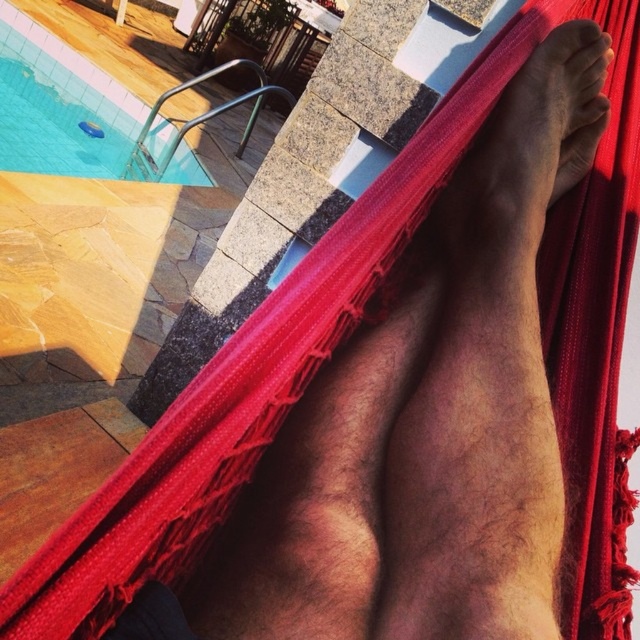
Does dark skin foot at upper right have a smaller size compared to blue glossy water at upper left?

Yes.

What are the coordinates of `dark skin foot at upper right` in the screenshot? It's located at (528, 150).